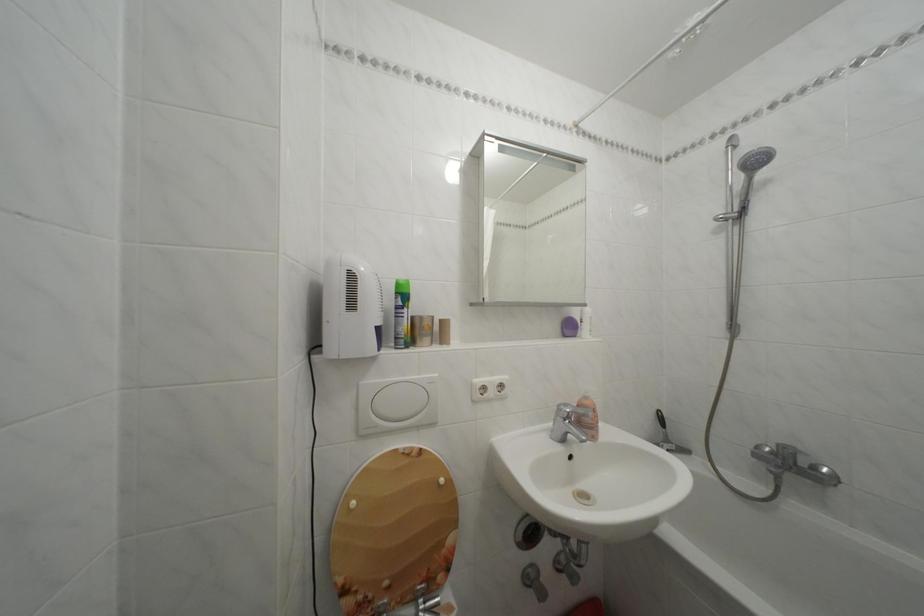
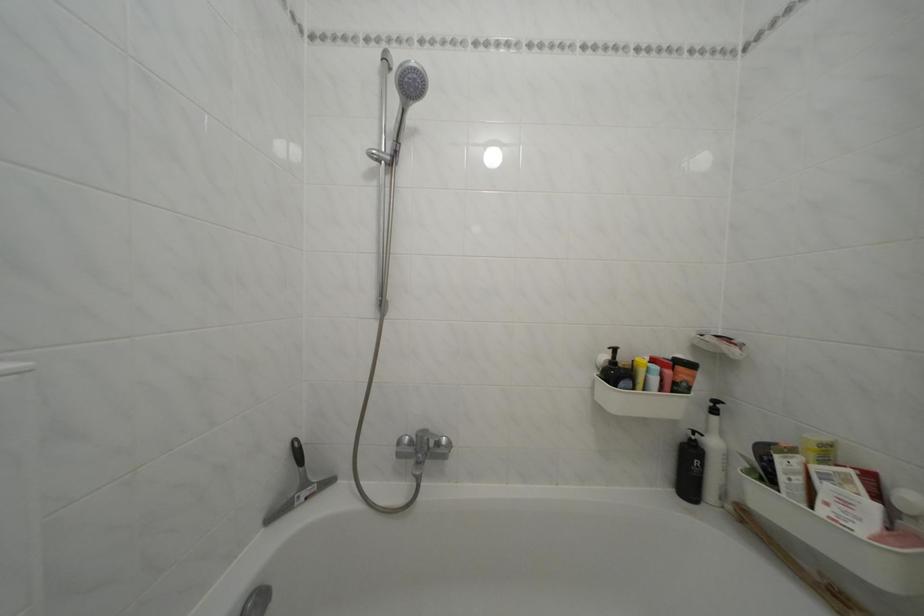
Question: The camera is either moving clockwise (left) or counter-clockwise (right) around the object. The first image is from the beginning of the video and the second image is from the end. Is the camera moving left or right when shooting the video?

Choices:
 (A) Left
 (B) Right

Answer: (A)